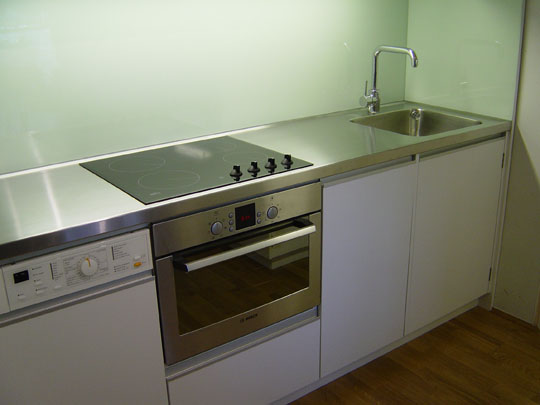
Find the location of a particular element. The width and height of the screenshot is (540, 405). sink tap is located at coordinates (410, 53).